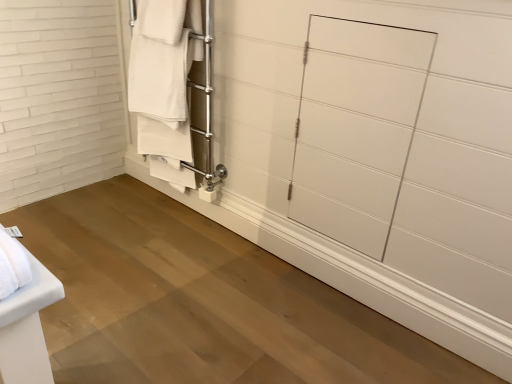
Question: From the image's perspective, is white matte towel rack at upper left located beneath white glossy door at center?

Choices:
 (A) yes
 (B) no

Answer: (B)

Question: Is white matte towel rack at upper left taller than white glossy door at center?

Choices:
 (A) yes
 (B) no

Answer: (A)

Question: Does white matte towel rack at upper left lie behind white glossy door at center?

Choices:
 (A) yes
 (B) no

Answer: (A)

Question: Could you tell me if white matte towel rack at upper left is turned towards white glossy door at center?

Choices:
 (A) no
 (B) yes

Answer: (A)

Question: From the image's perspective, is white matte towel rack at upper left on top of white glossy door at center?

Choices:
 (A) yes
 (B) no

Answer: (A)

Question: Considering the relative sizes of white matte towel rack at upper left and white glossy door at center in the image provided, is white matte towel rack at upper left smaller than white glossy door at center?

Choices:
 (A) no
 (B) yes

Answer: (A)

Question: Is white glossy door at center in contact with white matte towel rack at upper left?

Choices:
 (A) yes
 (B) no

Answer: (B)

Question: From a real-world perspective, is white glossy door at center located higher than white matte towel rack at upper left?

Choices:
 (A) no
 (B) yes

Answer: (A)

Question: Is there a large distance between white glossy door at center and white matte towel rack at upper left?

Choices:
 (A) yes
 (B) no

Answer: (B)

Question: Does white glossy door at center have a larger size compared to white matte towel rack at upper left?

Choices:
 (A) no
 (B) yes

Answer: (A)

Question: Is white glossy door at center to the left of white matte towel rack at upper left from the viewer's perspective?

Choices:
 (A) yes
 (B) no

Answer: (B)

Question: Is white glossy door at center to the right of white matte towel rack at upper left from the viewer's perspective?

Choices:
 (A) no
 (B) yes

Answer: (B)

Question: Considering the positions of white matte towel rack at upper left and white glossy door at center in the image, is white matte towel rack at upper left bigger or smaller than white glossy door at center?

Choices:
 (A) big
 (B) small

Answer: (A)